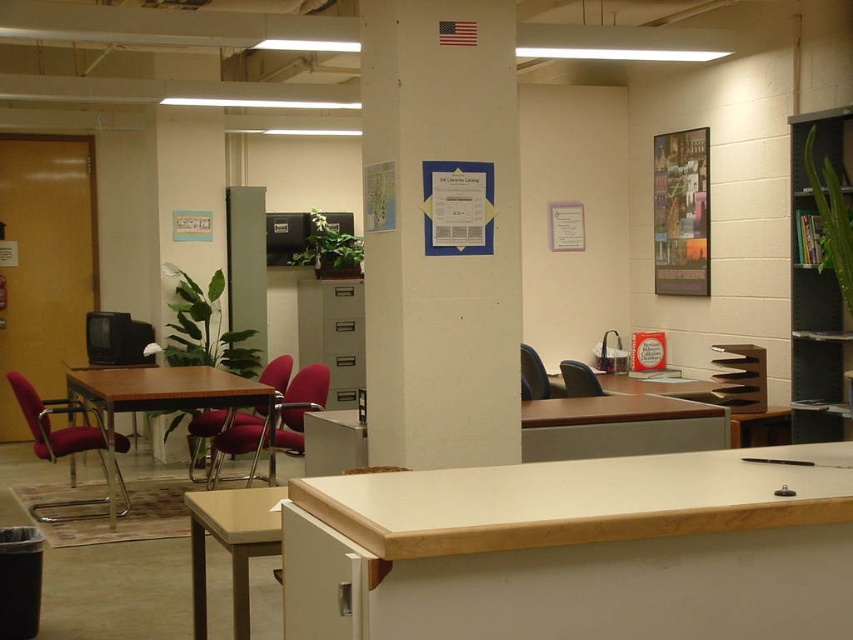
Question: Is light brown laminate table at lower center above matte red chair at center?

Choices:
 (A) no
 (B) yes

Answer: (A)

Question: Which object is the closest to the metallic poster at upper right?

Choices:
 (A) matte red chair at center
 (B) metallic red chair at center

Answer: (A)

Question: Which point is closer to the camera taking this photo?

Choices:
 (A) (276, 376)
 (B) (485, 556)
 (C) (582, 396)

Answer: (B)

Question: Based on their relative distances, which object is nearer to the wooden table at center?

Choices:
 (A) matte plastic chair at center
 (B) metallic red swivel chair at left

Answer: (B)

Question: Does metallic red swivel chair at left have a smaller size compared to matte red chair at center?

Choices:
 (A) yes
 (B) no

Answer: (B)

Question: Is light wood desk at center closer to the viewer compared to light brown laminate table at lower center?

Choices:
 (A) no
 (B) yes

Answer: (B)